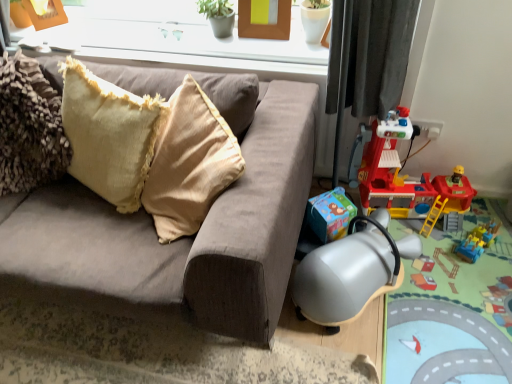
Question: Considering the relative sizes of plastic red fire station at right, positioned as the second toy in bottom-to-top order, and beige textured pillow at upper left in the image provided, is plastic red fire station at right, positioned as the second toy in bottom-to-top order, shorter than beige textured pillow at upper left?

Choices:
 (A) yes
 (B) no

Answer: (B)

Question: Considering the relative sizes of plastic red fire station at right, positioned as the second toy in bottom-to-top order, and beige textured pillow at upper left in the image provided, is plastic red fire station at right, positioned as the second toy in bottom-to-top order, wider than beige textured pillow at upper left?

Choices:
 (A) no
 (B) yes

Answer: (B)

Question: Is beige textured pillow at upper left completely or partially inside plastic red fire station at right, which ranks as the first toy in top-to-bottom order?

Choices:
 (A) yes
 (B) no

Answer: (B)

Question: Could you tell me if plastic red fire station at right, which ranks as the first toy in top-to-bottom order, is turned towards beige textured pillow at upper left?

Choices:
 (A) no
 (B) yes

Answer: (A)

Question: Can you confirm if plastic red fire station at right, which ranks as the first toy in top-to-bottom order, is bigger than beige textured pillow at upper left?

Choices:
 (A) yes
 (B) no

Answer: (A)

Question: In the image, is metallic gray swivel chair at lower right on the left side or the right side of white plastic window frame at upper center?

Choices:
 (A) left
 (B) right

Answer: (B)

Question: Considering the positions of metallic gray swivel chair at lower right and white plastic window frame at upper center in the image, is metallic gray swivel chair at lower right taller or shorter than white plastic window frame at upper center?

Choices:
 (A) short
 (B) tall

Answer: (B)

Question: Is metallic gray swivel chair at lower right in front of or behind white plastic window frame at upper center in the image?

Choices:
 (A) front
 (B) behind

Answer: (A)

Question: Does point (294, 292) appear closer or farther from the camera than point (138, 46)?

Choices:
 (A) farther
 (B) closer

Answer: (B)

Question: Relative to metallic plastic playset at lower right, is brown wooden picture frame at upper center in front or behind?

Choices:
 (A) front
 (B) behind

Answer: (B)

Question: From the image's perspective, is brown wooden picture frame at upper center located above or below metallic plastic playset at lower right?

Choices:
 (A) below
 (B) above

Answer: (B)

Question: In the image, is brown wooden picture frame at upper center on the left side or the right side of metallic plastic playset at lower right?

Choices:
 (A) right
 (B) left

Answer: (B)

Question: From their relative heights in the image, would you say brown wooden picture frame at upper center is taller or shorter than metallic plastic playset at lower right?

Choices:
 (A) tall
 (B) short

Answer: (A)

Question: In terms of height, does white plastic window frame at upper center look taller or shorter compared to metallic plastic playset at lower right?

Choices:
 (A) tall
 (B) short

Answer: (B)

Question: From the image's perspective, is white plastic window frame at upper center above or below metallic plastic playset at lower right?

Choices:
 (A) above
 (B) below

Answer: (A)